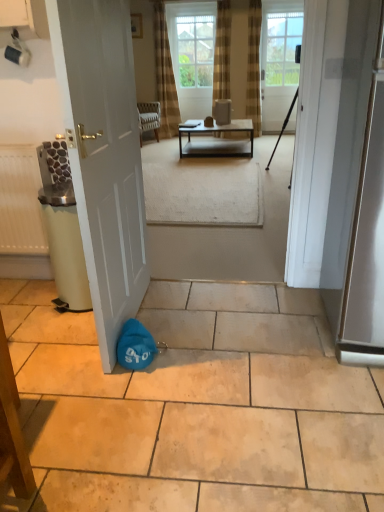
Question: Considering the relative sizes of clear glass window screen at upper center and metallic silver screen door at right in the image provided, is clear glass window screen at upper center bigger than metallic silver screen door at right?

Choices:
 (A) yes
 (B) no

Answer: (B)

Question: Can metallic silver screen door at right be found inside clear glass window screen at upper center?

Choices:
 (A) yes
 (B) no

Answer: (B)

Question: Considering the relative sizes of clear glass window screen at upper center and metallic silver screen door at right in the image provided, is clear glass window screen at upper center thinner than metallic silver screen door at right?

Choices:
 (A) yes
 (B) no

Answer: (A)

Question: Does clear glass window screen at upper center turn towards metallic silver screen door at right?

Choices:
 (A) yes
 (B) no

Answer: (A)

Question: Is clear glass window screen at upper center far away from metallic silver screen door at right?

Choices:
 (A) no
 (B) yes

Answer: (B)

Question: Is metallic black table at center spatially inside brown textured curtain at upper center, or outside of it?

Choices:
 (A) outside
 (B) inside

Answer: (A)

Question: Is metallic black table at center bigger or smaller than brown textured curtain at upper center?

Choices:
 (A) small
 (B) big

Answer: (B)

Question: From the image's perspective, is metallic black table at center above or below brown textured curtain at upper center?

Choices:
 (A) above
 (B) below

Answer: (B)

Question: Is point (248, 132) positioned closer to the camera than point (170, 61)?

Choices:
 (A) closer
 (B) farther

Answer: (A)

Question: Based on their positions, is white glass door at upper center, which appears as the 1th door when viewed from the back, located to the left or right of white matte door at left, which ranks as the 2th door in right-to-left order?

Choices:
 (A) right
 (B) left

Answer: (A)

Question: From a real-world perspective, is white glass door at upper center, which appears as the 1th door when viewed from the back, physically located above or below white matte door at left, the 1th door in the left-to-right sequence?

Choices:
 (A) below
 (B) above

Answer: (B)

Question: Is white glass door at upper center, the 2th door ordered from the bottom, inside the boundaries of white matte door at left, the first door in the front-to-back sequence, or outside?

Choices:
 (A) inside
 (B) outside

Answer: (B)

Question: In the image, is white glass door at upper center, acting as the second door starting from the front, positioned in front of or behind white matte door at left, the first door in the front-to-back sequence?

Choices:
 (A) front
 (B) behind

Answer: (B)

Question: Would you say brown textured curtain at upper center is to the left or to the right of clear glass window screen at upper center in the picture?

Choices:
 (A) right
 (B) left

Answer: (B)

Question: From a real-world perspective, is brown textured curtain at upper center above or below clear glass window screen at upper center?

Choices:
 (A) below
 (B) above

Answer: (A)